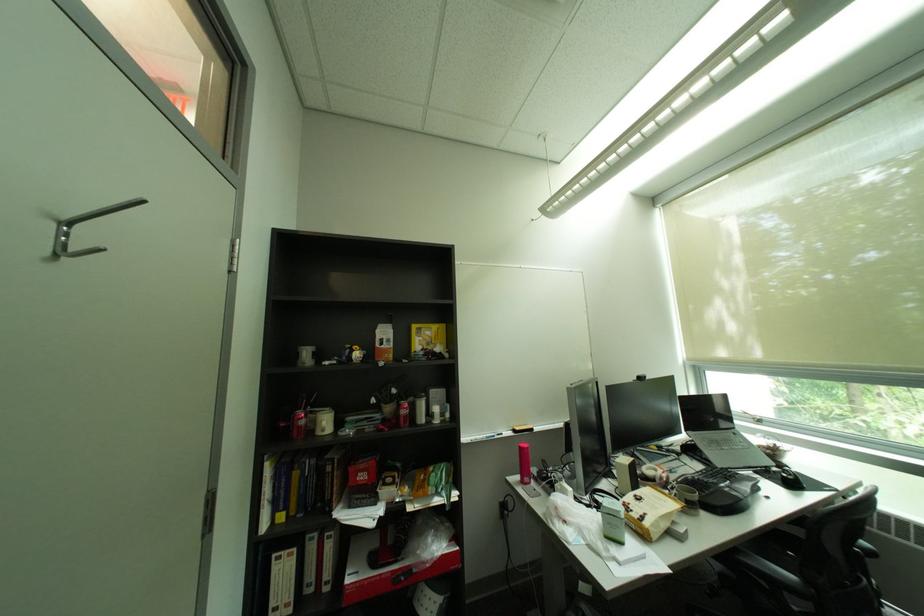
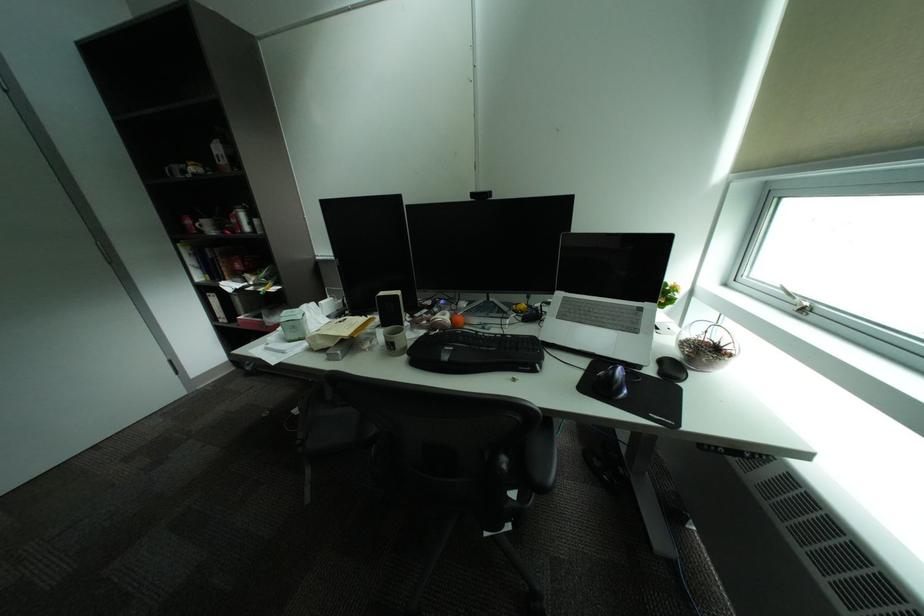
Locate, in the second image, the point that corresponds to the point at 435,564 in the first image.

(281, 323)